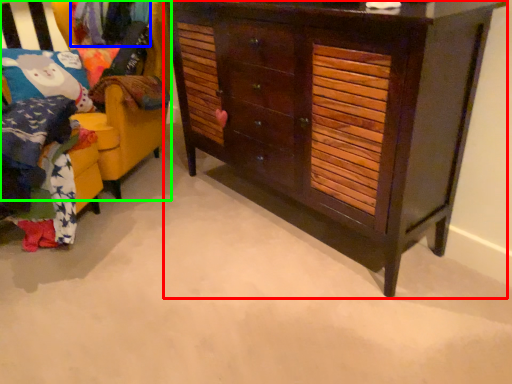
Question: Based on their relative distances, which object is nearer to chest of drawers (highlighted by a red box)? Choose from clothing (highlighted by a blue box) and furniture (highlighted by a green box).

Choices:
 (A) clothing
 (B) furniture

Answer: (B)